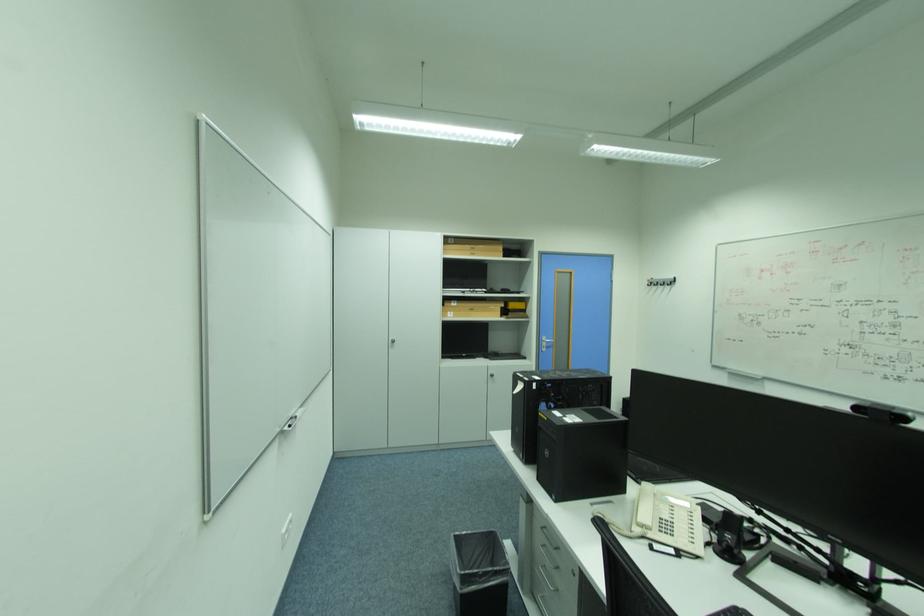
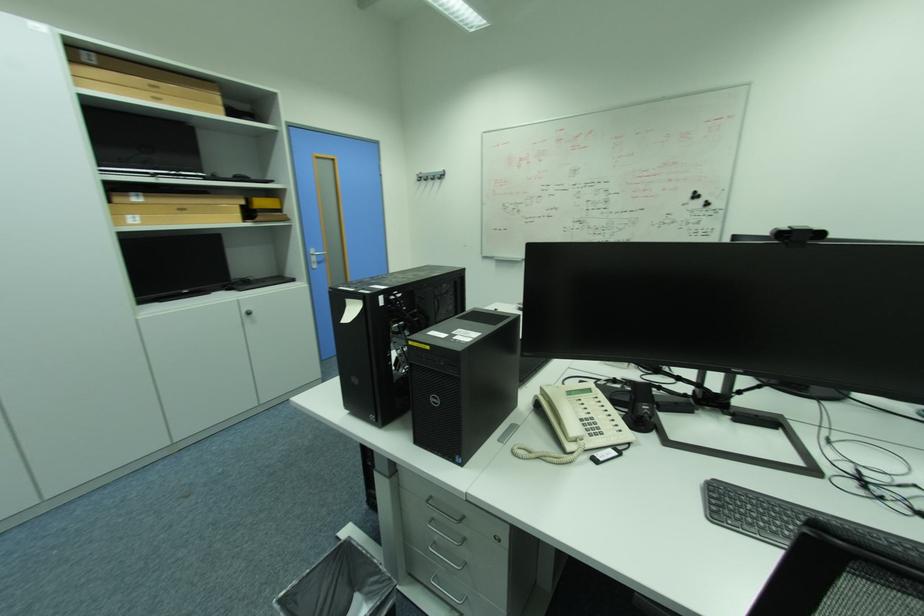
Find the pixel in the second image that matches point 550,529 in the first image.

(435, 501)